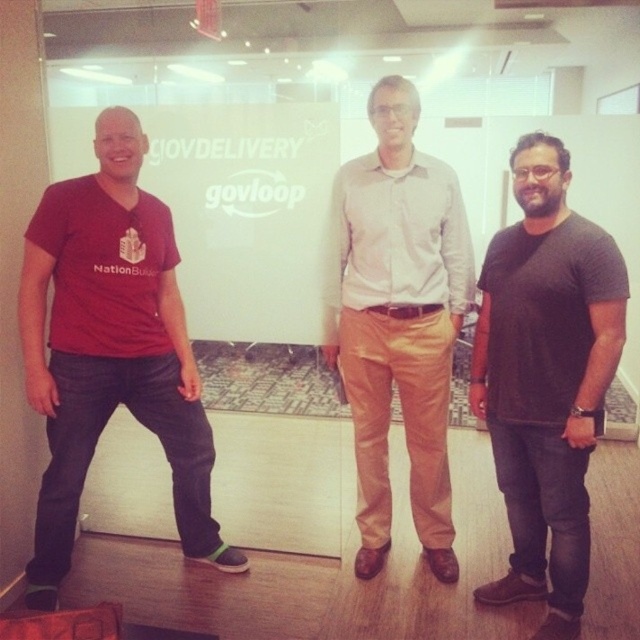
Question: Is dark gray t-shirt at center bigger than light brown cotton pants at center?

Choices:
 (A) yes
 (B) no

Answer: (B)

Question: Which object appears farthest from the camera in this image?

Choices:
 (A) matte red t-shirt at left
 (B) dark gray t-shirt at center
 (C) light brown cotton pants at center

Answer: (C)

Question: Which object is farther from the camera taking this photo?

Choices:
 (A) matte red t-shirt at left
 (B) dark gray t-shirt at center
 (C) light brown cotton pants at center

Answer: (C)

Question: Does matte red t-shirt at left have a smaller size compared to light brown cotton pants at center?

Choices:
 (A) yes
 (B) no

Answer: (B)

Question: Can you confirm if matte red t-shirt at left is bigger than light brown cotton pants at center?

Choices:
 (A) yes
 (B) no

Answer: (A)

Question: Which object is positioned closest to the dark gray t-shirt at center?

Choices:
 (A) matte red t-shirt at left
 (B) light brown cotton pants at center

Answer: (B)